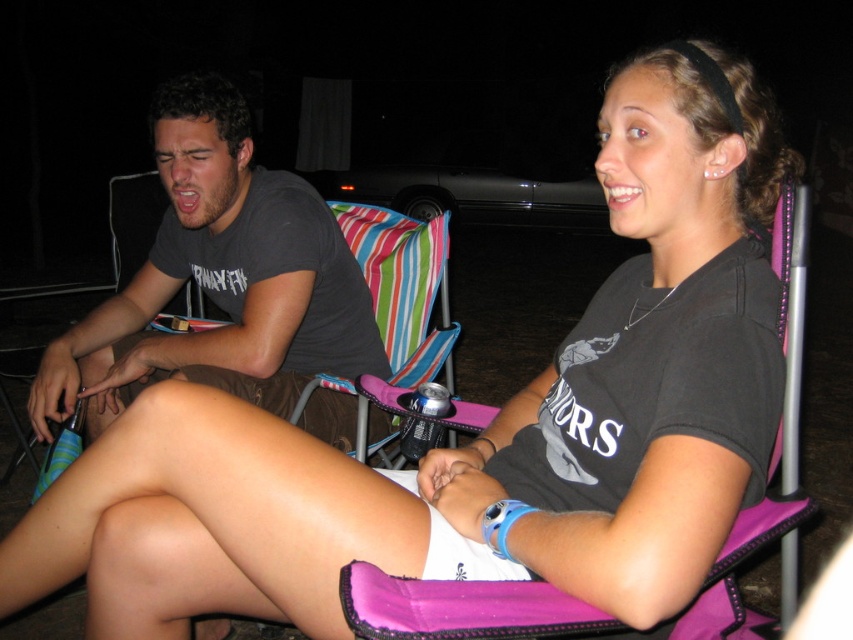
Who is more distant from viewer, (142, 380) or (738, 536)?

Positioned behind is point (142, 380).

Who is higher up, dark gray t-shirt at left or purple fabric beach chair at right?

dark gray t-shirt at left is higher up.

Is point (294, 192) positioned before point (450, 634)?

No.

This screenshot has height=640, width=853. I want to click on dark gray t-shirt at left, so click(219, 278).